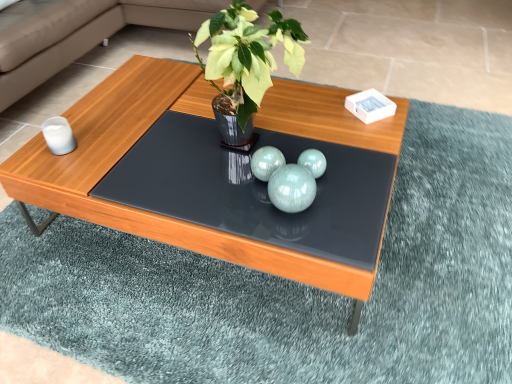
Question: From the image's perspective, would you say teal glossy spheres at center is positioned over green glossy vase at center?

Choices:
 (A) yes
 (B) no

Answer: (B)

Question: Is green glossy vase at center surrounded by teal glossy spheres at center?

Choices:
 (A) yes
 (B) no

Answer: (B)

Question: Is teal glossy spheres at center facing towards green glossy vase at center?

Choices:
 (A) no
 (B) yes

Answer: (A)

Question: Can you confirm if teal glossy spheres at center is bigger than green glossy vase at center?

Choices:
 (A) yes
 (B) no

Answer: (B)

Question: Is the depth of teal glossy spheres at center greater than that of green glossy vase at center?

Choices:
 (A) yes
 (B) no

Answer: (A)

Question: In the image, is matte wooden coffee table at center positioned in front of or behind green glossy vase at center?

Choices:
 (A) behind
 (B) front

Answer: (A)

Question: In terms of width, does matte wooden coffee table at center look wider or thinner when compared to green glossy vase at center?

Choices:
 (A) thin
 (B) wide

Answer: (B)

Question: Would you say matte wooden coffee table at center is to the left or to the right of green glossy vase at center in the picture?

Choices:
 (A) right
 (B) left

Answer: (B)

Question: Does point (188, 112) appear closer or farther from the camera than point (224, 29)?

Choices:
 (A) closer
 (B) farther

Answer: (B)

Question: In the image, is teal glossy spheres at center on the left side or the right side of green glossy vase at center?

Choices:
 (A) right
 (B) left

Answer: (A)

Question: Is teal glossy spheres at center wider or thinner than green glossy vase at center?

Choices:
 (A) thin
 (B) wide

Answer: (A)

Question: Is point (285, 192) positioned closer to the camera than point (231, 142)?

Choices:
 (A) farther
 (B) closer

Answer: (B)

Question: From the image's perspective, is teal glossy spheres at center above or below green glossy vase at center?

Choices:
 (A) above
 (B) below

Answer: (B)

Question: From the image's perspective, is shiny black glass table at center positioned above or below teal glossy spheres at center?

Choices:
 (A) above
 (B) below

Answer: (A)

Question: In the image, is shiny black glass table at center positioned in front of or behind teal glossy spheres at center?

Choices:
 (A) front
 (B) behind

Answer: (A)